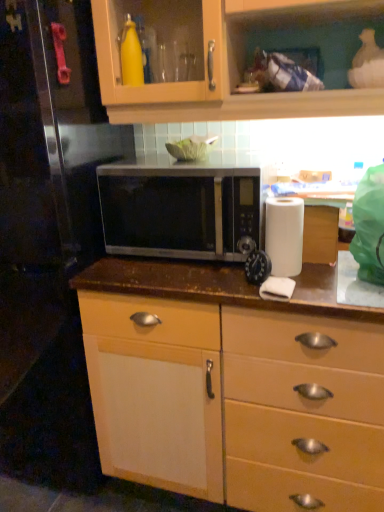
Question: Is point (241, 371) positioned closer to the camera than point (261, 275)?

Choices:
 (A) farther
 (B) closer

Answer: (A)

Question: From a real-world perspective, is brown polished wood countertop at center positioned above or below black plastic clock at center?

Choices:
 (A) above
 (B) below

Answer: (B)

Question: Estimate the real-world distances between objects in this image. Which object is farther from the black plastic clock at center?

Choices:
 (A) white matte paper towel at right
 (B) brown polished wood countertop at center
 (C) satin silver microwave at center

Answer: (B)

Question: Estimate the real-world distances between objects in this image. Which object is farther from the brown polished wood countertop at center?

Choices:
 (A) white matte paper towel at right
 (B) black plastic clock at center
 (C) satin silver microwave at center

Answer: (A)